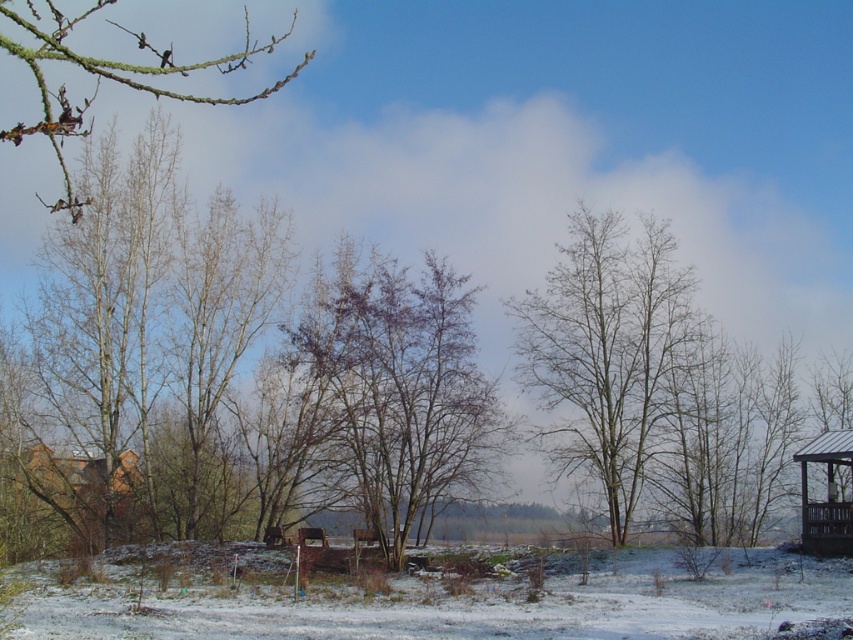
Question: Does brown wooden hut at lower left come in front of brown wooden gazebo at right?

Choices:
 (A) yes
 (B) no

Answer: (B)

Question: Does green mossy branch at upper left have a greater width compared to brown wooden gazebo at right?

Choices:
 (A) no
 (B) yes

Answer: (B)

Question: Which object appears farthest from the camera in this image?

Choices:
 (A) brown wooden gazebo at right
 (B) purple-barked tree at center
 (C) brown wooden hut at lower left
 (D) green mossy branch at upper left

Answer: (C)

Question: Which of the following is the farthest from the observer?

Choices:
 (A) (222, 61)
 (B) (848, 508)
 (C) (341, 376)
 (D) (53, 476)

Answer: (A)

Question: Which object is closer to the camera taking this photo?

Choices:
 (A) brown wooden gazebo at right
 (B) bare branches at center
 (C) brown wooden hut at lower left

Answer: (A)

Question: Is green mossy branch at upper left wider than brown wooden hut at lower left?

Choices:
 (A) no
 (B) yes

Answer: (B)